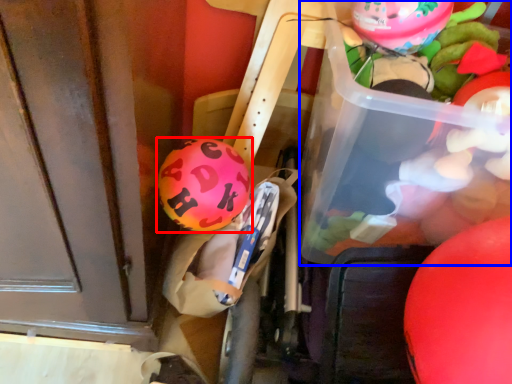
Question: Which of the following is the closest to the observer, balloon (highlighted by a red box) or wide (highlighted by a blue box)?

Choices:
 (A) balloon
 (B) wide

Answer: (B)